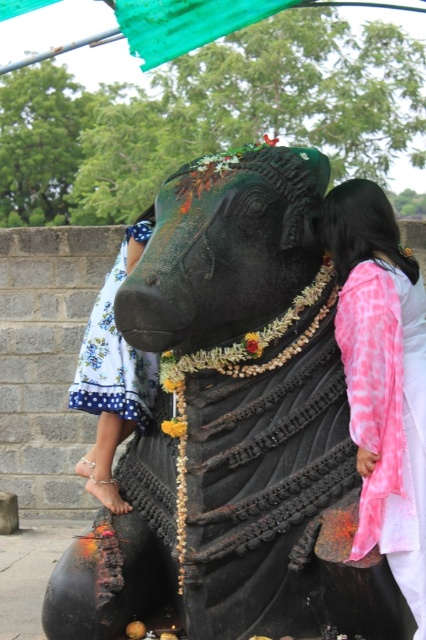
Is point (353, 486) more distant than point (115, 284)?

No, it is not.

Which is below, black stone statue at center or blue floral fabric dress at left?

Positioned lower is black stone statue at center.

In order to click on black stone statue at center in this screenshot , I will do `click(233, 426)`.

Who is more forward, (x=250, y=182) or (x=374, y=374)?

Point (x=374, y=374) is more forward.

Does point (270, 360) come behind point (374, 356)?

That is True.

Image resolution: width=426 pixels, height=640 pixels. What do you see at coordinates (233, 426) in the screenshot?
I see `black stone statue at center` at bounding box center [233, 426].

Identify the location of black stone statue at center. (233, 426).

Who is shorter, pink tie-dye kurta at right or blue floral fabric dress at left?

With less height is blue floral fabric dress at left.

Describe the element at coordinates (382, 378) in the screenshot. The width and height of the screenshot is (426, 640). I see `pink tie-dye kurta at right` at that location.

The width and height of the screenshot is (426, 640). What are the coordinates of `pink tie-dye kurta at right` in the screenshot? It's located at (382, 378).